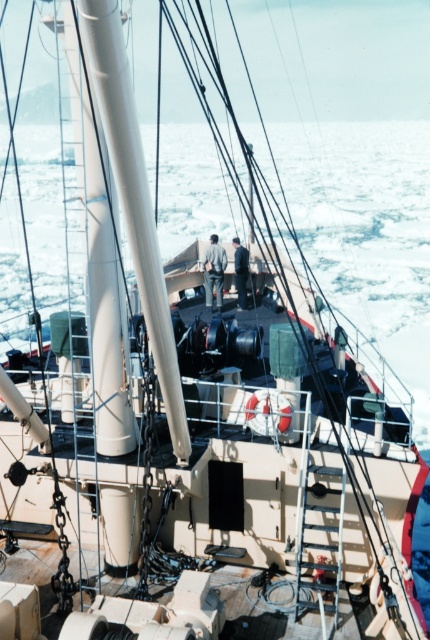
Between dark gray fabric pants at center and dark gray fabric jacket at center, which one appears on the left side from the viewer's perspective?

dark gray fabric pants at center is more to the left.

Is point (217, 298) farther from camera compared to point (246, 307)?

Yes, point (217, 298) is behind point (246, 307).

In order to click on dark gray fabric pants at center in this screenshot , I will do `click(214, 273)`.